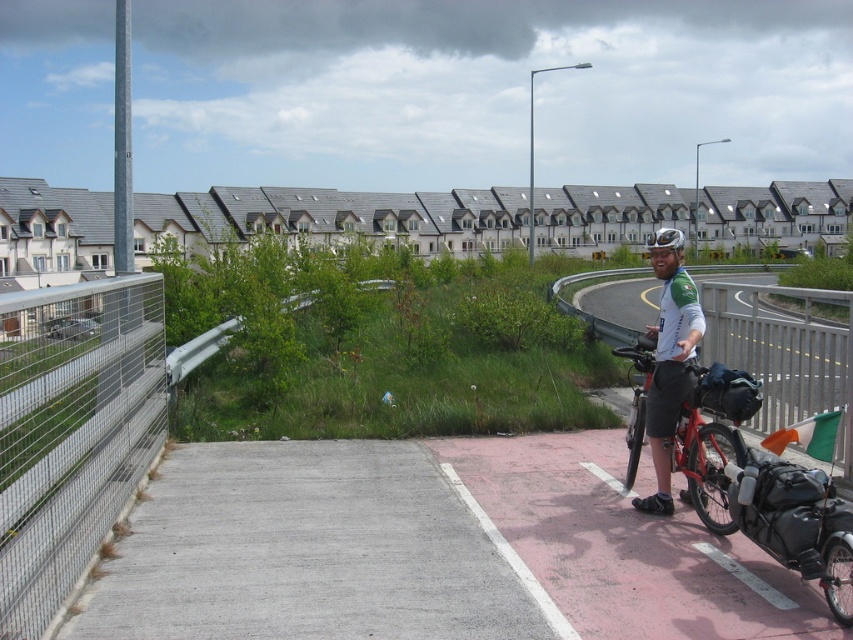
Question: Does gray concrete bike lane at center have a smaller size compared to metal mesh fence at left?

Choices:
 (A) no
 (B) yes

Answer: (B)

Question: Does gray concrete bike lane at center appear over concrete at center?

Choices:
 (A) yes
 (B) no

Answer: (B)

Question: Which is farther from the metal mesh fence at left?

Choices:
 (A) concrete at center
 (B) matte red bicycle at right

Answer: (A)

Question: Which of these objects is positioned farthest from the white fabric shirt at center?

Choices:
 (A) metal mesh fence at left
 (B) matte red bicycle at right
 (C) gray concrete bike lane at center

Answer: (A)

Question: Can you confirm if gray concrete bike lane at center is thinner than concrete at center?

Choices:
 (A) yes
 (B) no

Answer: (A)

Question: Which point is farther to the camera?

Choices:
 (A) (483, 592)
 (B) (680, 468)

Answer: (B)